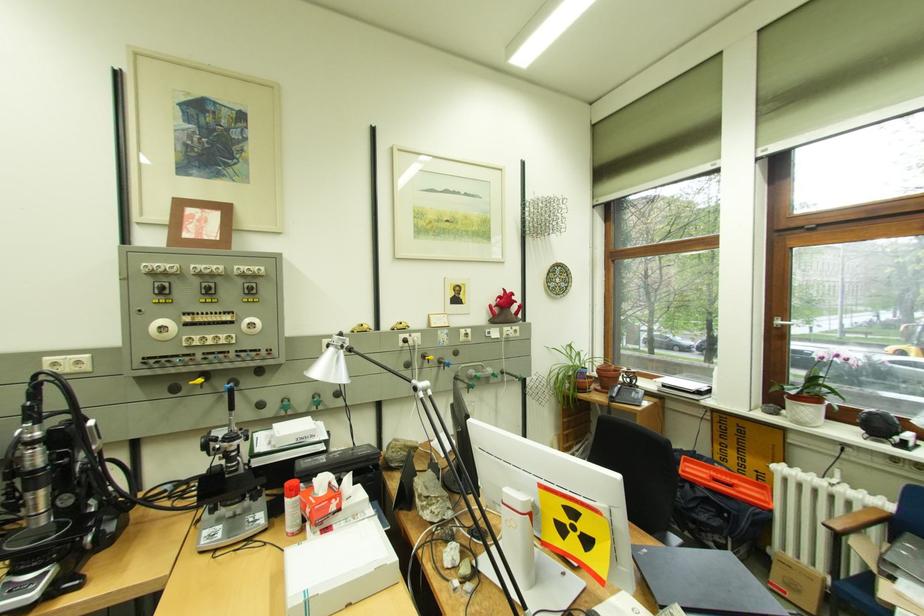
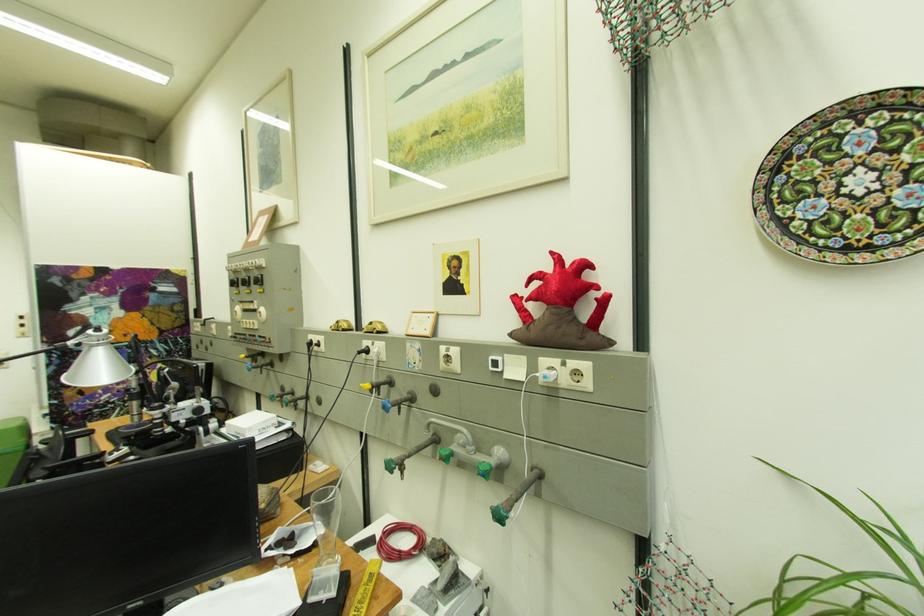
The point at (457, 222) is marked in the first image. Where is the corresponding point in the second image?

(446, 134)